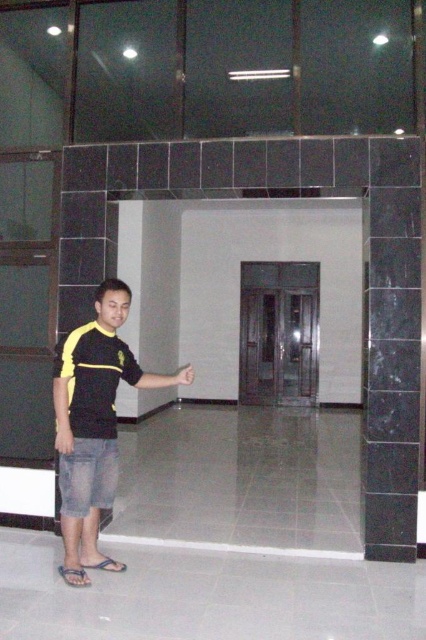
Is gray fabric sandal at lower left below skinny yellow shirt sleeve at lower left?

Indeed, gray fabric sandal at lower left is positioned under skinny yellow shirt sleeve at lower left.

Based on the photo, can you confirm if gray fabric sandal at lower left is smaller than skinny yellow shirt sleeve at lower left?

Indeed, gray fabric sandal at lower left has a smaller size compared to skinny yellow shirt sleeve at lower left.

Measure the distance between point [69,584] and camera.

A distance of 3.37 meters exists between point [69,584] and camera.

The image size is (426, 640). In order to click on gray fabric sandal at lower left in this screenshot , I will do `click(74, 577)`.

This screenshot has height=640, width=426. What do you see at coordinates (92, 417) in the screenshot?
I see `yellow-black shirt at left` at bounding box center [92, 417].

Measure the distance between point (71, 362) and camera.

3.47 meters

You are a GUI agent. You are given a task and a screenshot of the screen. Output one action in this format:
    pyautogui.click(x=<x>, y=<y>)
    Task: Click on the yellow-black shirt at left
    This screenshot has width=426, height=640.
    Given the screenshot: What is the action you would take?
    pyautogui.click(x=92, y=417)

Who is positioned more to the right, blue rubber sandal at lower left or gray fabric sandal at lower left?

blue rubber sandal at lower left is more to the right.

Image resolution: width=426 pixels, height=640 pixels. What do you see at coordinates (103, 563) in the screenshot? I see `blue rubber sandal at lower left` at bounding box center [103, 563].

The image size is (426, 640). Identify the location of blue rubber sandal at lower left. (103, 563).

This screenshot has height=640, width=426. I want to click on blue rubber sandal at lower left, so pos(103,563).